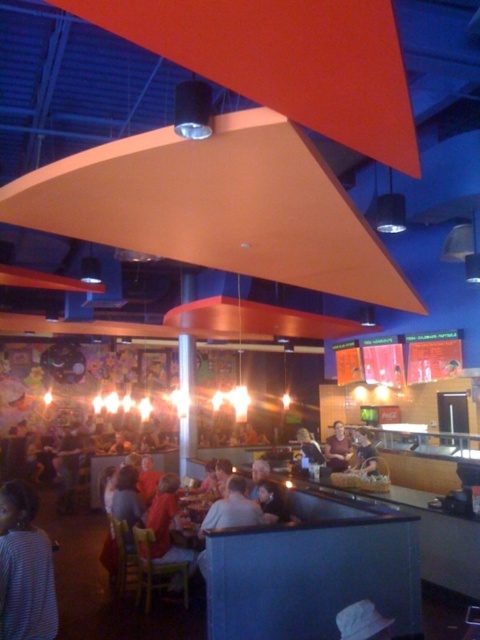
Question: Is striped shirt at lower left positioned behind smooth beige shirt at center?

Choices:
 (A) yes
 (B) no

Answer: (B)

Question: Does striped shirt at lower left appear over dark brown leather jacket at center?

Choices:
 (A) yes
 (B) no

Answer: (A)

Question: Which is nearer to the smooth beige shirt at center?

Choices:
 (A) striped shirt at lower left
 (B) light brown leather jacket at lower center
 (C) dark brown leather jacket at center
 (D) matte black jacket at center

Answer: (C)

Question: Which object appears closest to the camera in this image?

Choices:
 (A) smooth beige shirt at center
 (B) light brown leather jacket at lower center
 (C) dark brown leather jacket at center
 (D) matte black jacket at center

Answer: (B)

Question: Among these objects, which one is farthest from the camera?

Choices:
 (A) striped shirt at lower left
 (B) matte black jacket at center
 (C) light brown leather jacket at lower center

Answer: (B)

Question: From the image, what is the correct spatial relationship of light brown leather jacket at lower center in relation to dark brown leather jacket at center?

Choices:
 (A) below
 (B) above

Answer: (B)